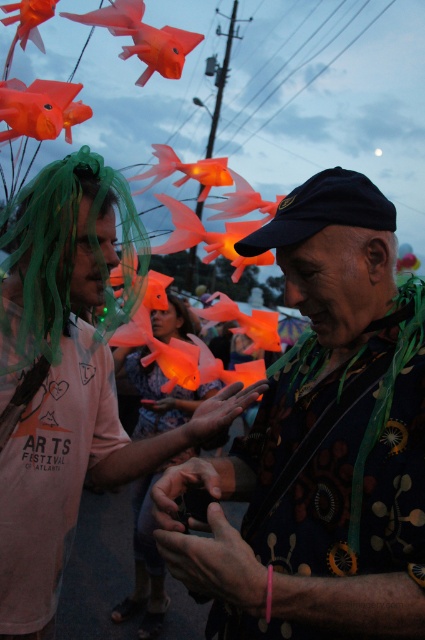
Question: Is matte orange fish at left further to the viewer compared to green tulle wig at left?

Choices:
 (A) yes
 (B) no

Answer: (B)

Question: Considering the real-world distances, which object is farthest from the matte orange fish at left?

Choices:
 (A) green tulle wig at left
 (B) floral-patterned shirt at center

Answer: (B)

Question: Which object appears closest to the camera in this image?

Choices:
 (A) matte orange fish at left
 (B) green tulle wig at left
 (C) floral-patterned shirt at center

Answer: (C)

Question: Can you confirm if floral-patterned shirt at center is bigger than green tulle wig at left?

Choices:
 (A) no
 (B) yes

Answer: (B)

Question: Can you confirm if matte orange fish at left is smaller than green tulle wig at left?

Choices:
 (A) no
 (B) yes

Answer: (A)

Question: Among these objects, which one is farthest from the camera?

Choices:
 (A) floral-patterned shirt at center
 (B) green tulle wig at left
 (C) matte orange fish at left

Answer: (B)